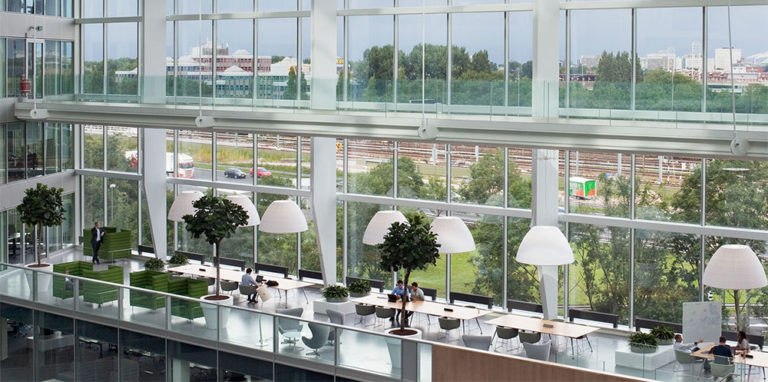
Image resolution: width=768 pixels, height=382 pixels. Find the location of `inside plants`. inside plants is located at coordinates (667, 333), (644, 341), (412, 245), (362, 286), (336, 295), (223, 216), (51, 216), (151, 263), (180, 254).